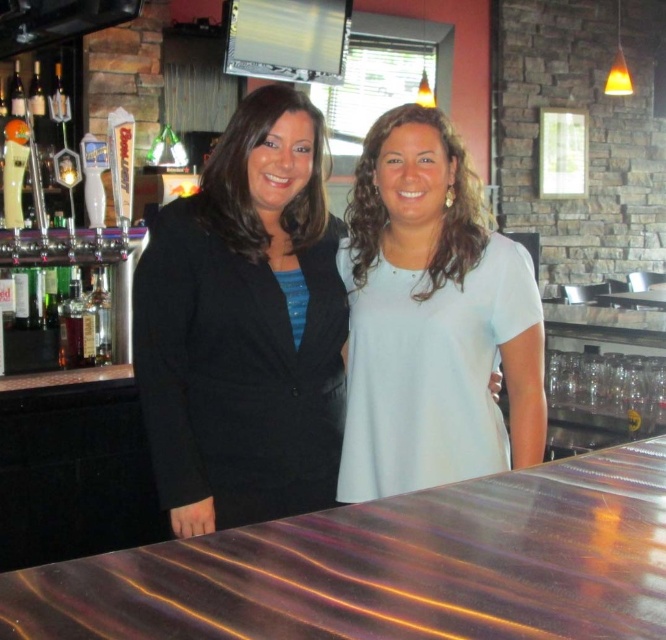
You are a customer at the bar and want to order a drink. You notice two staff members wearing the black fabric jacket at center and the light blue fabric shirt at center. Which staff member is standing to the left of the other?

The black fabric jacket at center is positioned on the left side of light blue fabric shirt at center, so the staff member wearing the black fabric jacket at center is to the left of the one in the light blue fabric shirt at center.

You are a customer at the bar and want to know which piece of clothing is bigger between the black fabric jacket at center and the light blue fabric shirt at center. Can you tell me?

The black fabric jacket at center is larger in size than the light blue fabric shirt at center.